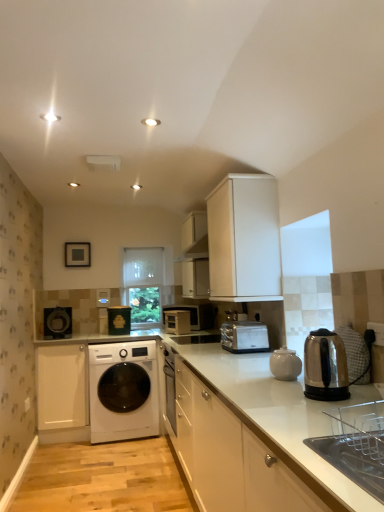
This screenshot has width=384, height=512. I want to click on vacant area that is in front of stainless steel kettle at right, which appears as the second home appliance when viewed from the back, so point(323,413).